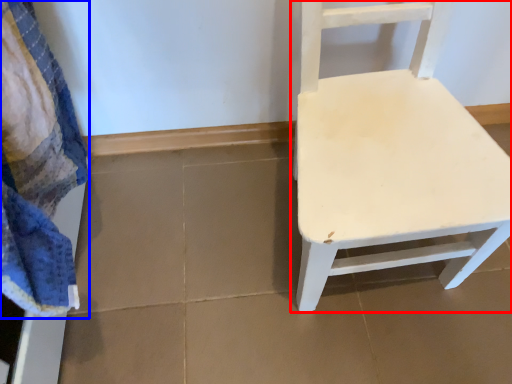
Question: Which point is closer to the camera, chair (highlighted by a red box) or bath towel (highlighted by a blue box)?

Choices:
 (A) chair
 (B) bath towel

Answer: (B)